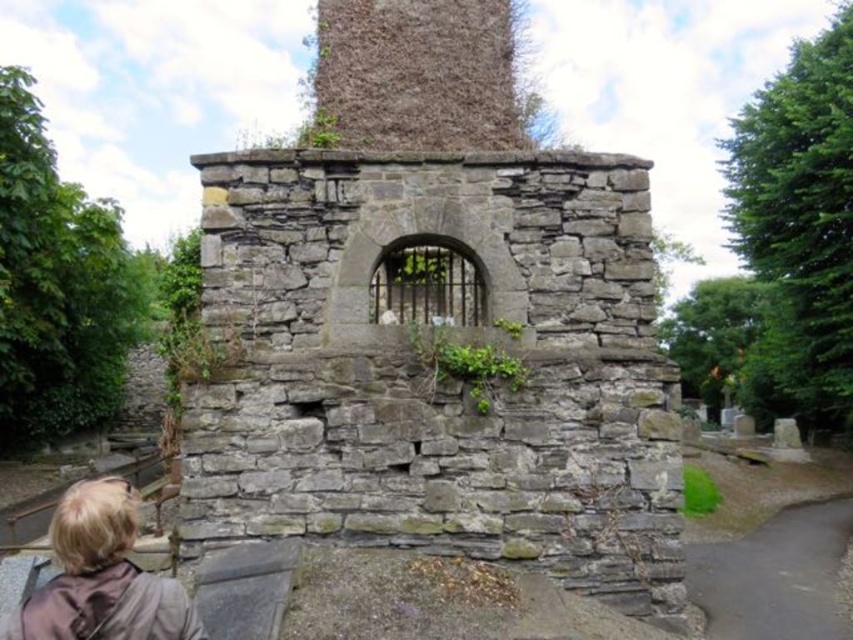
Question: Can you confirm if gray stone ruins at center is thinner than blonde hair at lower left?

Choices:
 (A) yes
 (B) no

Answer: (B)

Question: Which of the following is the farthest from the observer?

Choices:
 (A) (88, 492)
 (B) (515, 525)

Answer: (B)

Question: Which point is closer to the camera?

Choices:
 (A) (78, 552)
 (B) (582, 250)

Answer: (A)

Question: Is gray stone ruins at center smaller than blonde hair at lower left?

Choices:
 (A) no
 (B) yes

Answer: (A)

Question: Observing the image, what is the correct spatial positioning of gray stone ruins at center in reference to blonde hair at lower left?

Choices:
 (A) right
 (B) left

Answer: (A)